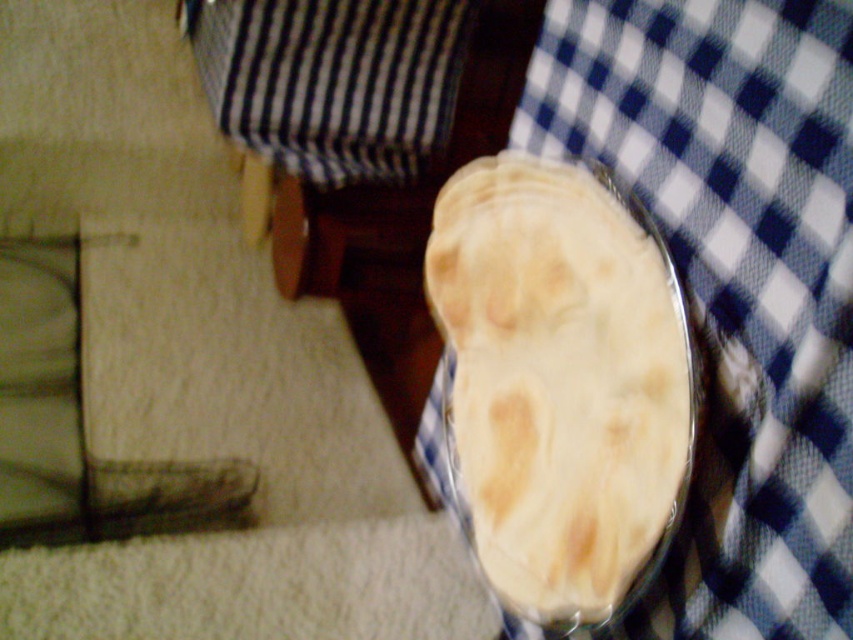
You are standing in a kitchen and see the black striped fabric at upper center. If you want to reach it without moving your feet, can you do it?

The black striped fabric at upper center is 1.58 meters away from viewer, so if you can reach 1.58 meters without moving your feet, you can do it. Otherwise, you might need to move closer or use a tool.

You are a chef preparing to serve a dish. You see the black striped fabric at upper center and the white matte flatbread at center. Which object is covering the other?

The black striped fabric at upper center is positioned over the white matte flatbread at center, so it is covering it.